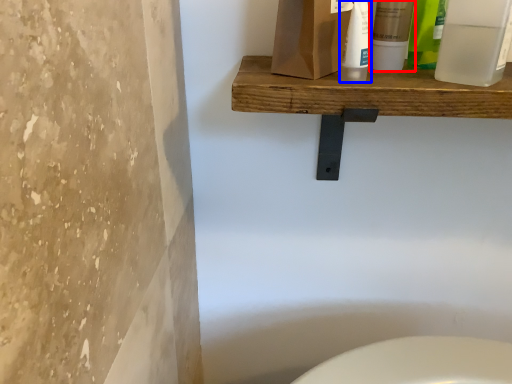
Question: Among these objects, which one is farthest to the camera, mouthwash (highlighted by a red box) or cleaning product (highlighted by a blue box)?

Choices:
 (A) mouthwash
 (B) cleaning product

Answer: (A)